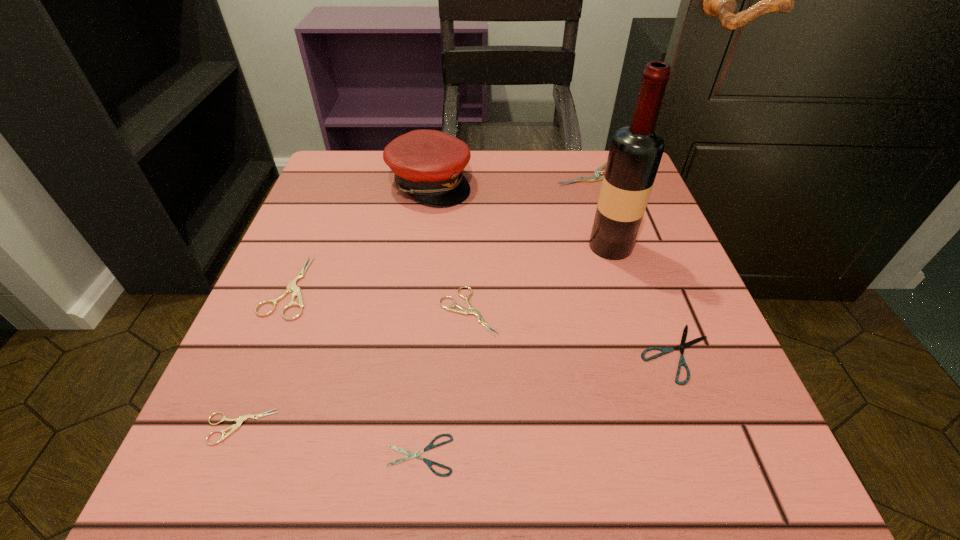
Identify the location of vacant region between the smaller black shears and the bigger black shears. (548, 404).

Image resolution: width=960 pixels, height=540 pixels. I want to click on free space between the sixth shortest object and the nearest beige shears, so click(417, 301).

I want to click on empty location between the shortest object and the farthest shears, so click(507, 315).

Where is `free space between the second tallest shears and the red cap`? free space between the second tallest shears and the red cap is located at coordinates (360, 235).

Find the location of a particular element. free area in between the wine bottle and the fourth shortest shears is located at coordinates (540, 279).

At what (x,y) coordinates should I click in order to perform the action: click on object that is the fifth closest one to the second tallest shears. Please return your answer as a coordinate pair (x, y). The height and width of the screenshot is (540, 960). Looking at the image, I should click on (635, 153).

Identify which object is the seventh closest to the third biggest beige shears. Please provide its 2D coordinates. Your answer should be formatted as a tuple, i.e. [(x, y)], where the tuple contains the x and y coordinates of a point satisfying the conditions above.

[(596, 176)]

Point out which shears is positioned as the fifth nearest to the left black shears. Please provide its 2D coordinates. Your answer should be formatted as a tuple, i.e. [(x, y)], where the tuple contains the x and y coordinates of a point satisfying the conditions above.

[(596, 176)]

Identify which shears is located as the nearest to the right black shears. Please provide its 2D coordinates. Your answer should be formatted as a tuple, i.e. [(x, y)], where the tuple contains the x and y coordinates of a point satisfying the conditions above.

[(462, 310)]

Locate an element on the screen. Image resolution: width=960 pixels, height=540 pixels. the closest beige shears relative to the tallest object is located at coordinates (596, 176).